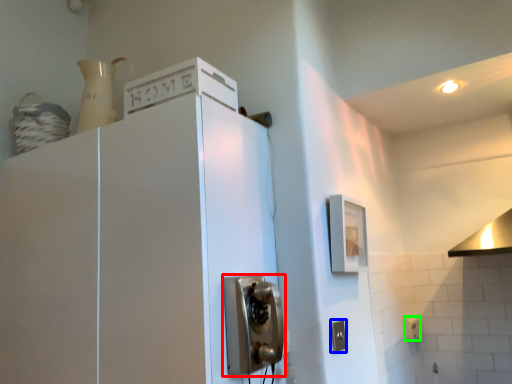
Question: Which object is the farthest from door handle (highlighted by a red box)? Choose among these: electric outlet (highlighted by a blue box) or electric outlet (highlighted by a green box).

Choices:
 (A) electric outlet
 (B) electric outlet

Answer: (B)